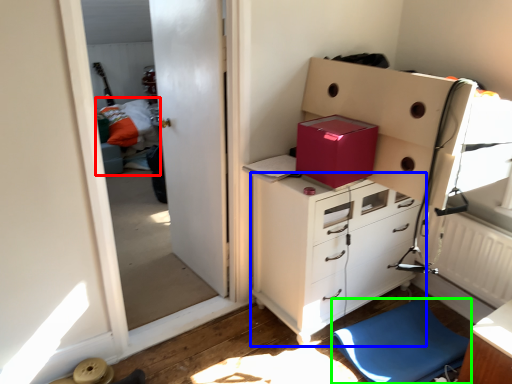
Question: Which is nearer to the bed (highlighted by a red box)? chest of drawers (highlighted by a blue box) or furniture (highlighted by a green box).

Choices:
 (A) chest of drawers
 (B) furniture

Answer: (A)